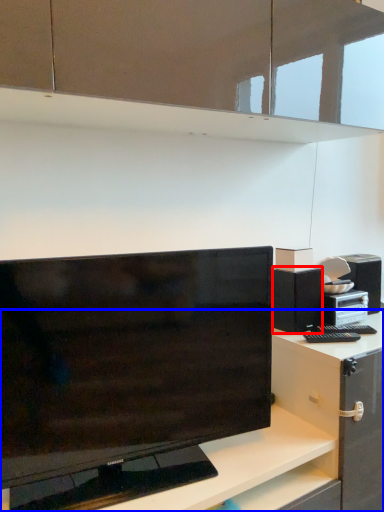
Question: Which of the following is the farthest to the observer, cabinetry (highlighted by a red box) or desk (highlighted by a blue box)?

Choices:
 (A) cabinetry
 (B) desk

Answer: (A)